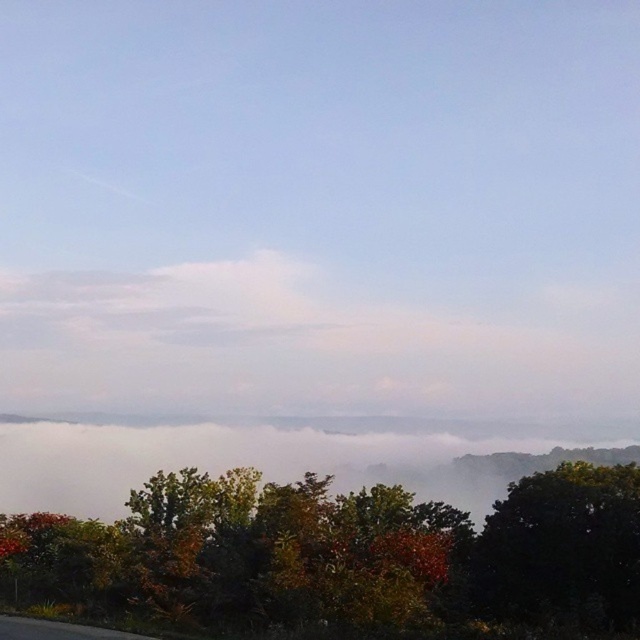
Question: Can you confirm if green matte tree at lower center is smaller than white fluffy cloud at center?

Choices:
 (A) no
 (B) yes

Answer: (B)

Question: Does green matte tree at lower center appear over white fluffy cloud at center?

Choices:
 (A) yes
 (B) no

Answer: (B)

Question: Which point is farther to the camera?

Choices:
 (A) green matte tree at lower center
 (B) green leafy tree at center

Answer: (B)

Question: Which point appears farthest from the camera in this image?

Choices:
 (A) (496, 616)
 (B) (552, 291)
 (C) (342, 540)

Answer: (B)

Question: Which of these objects is positioned closest to the green leafy tree at center?

Choices:
 (A) white fluffy cloud at center
 (B) green matte tree at lower center

Answer: (B)

Question: Is green matte tree at lower center positioned behind white fluffy cloud at center?

Choices:
 (A) yes
 (B) no

Answer: (B)